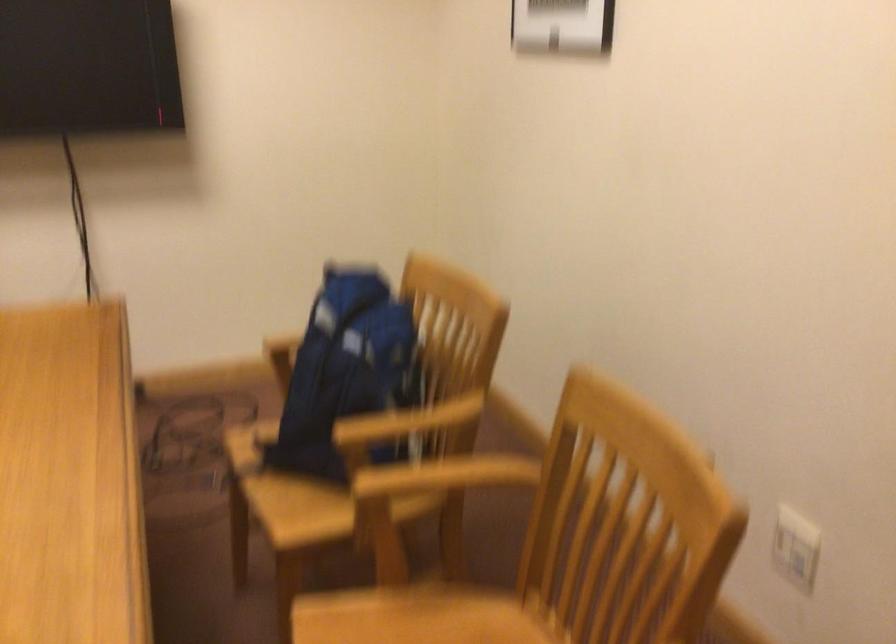
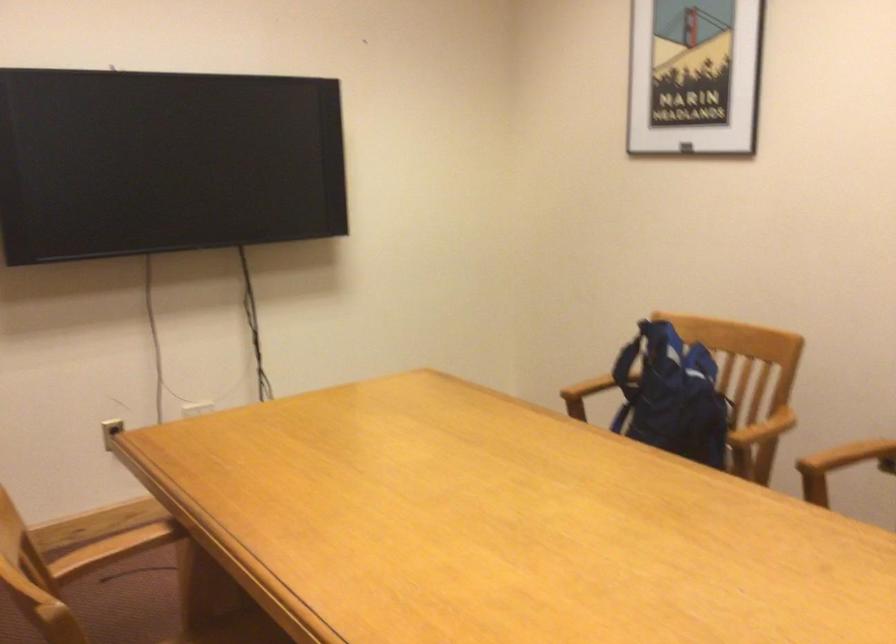
Locate, in the second image, the point that corresponds to (340,366) in the first image.

(672, 395)